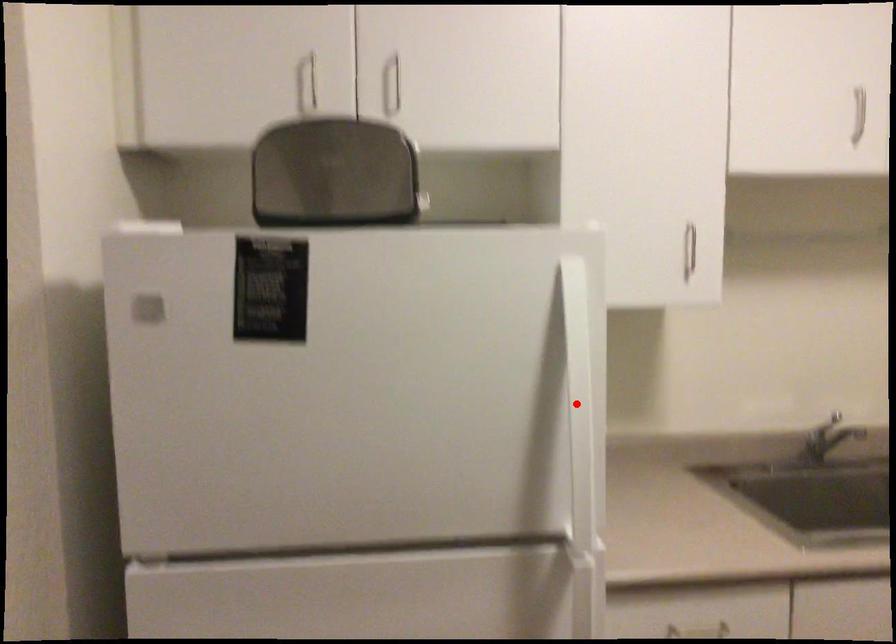
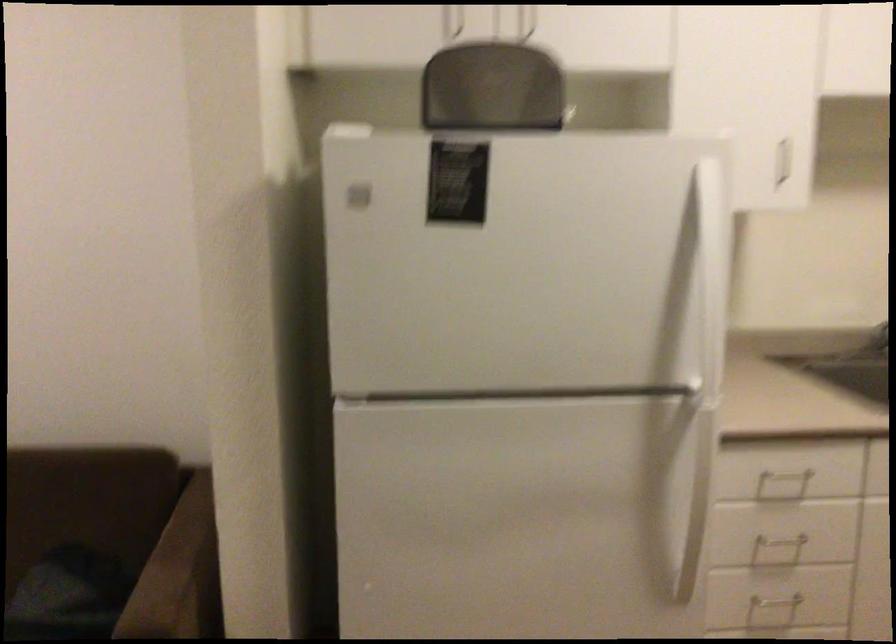
In the second image, find the point that corresponds to the highlighted location in the first image.

(711, 272)